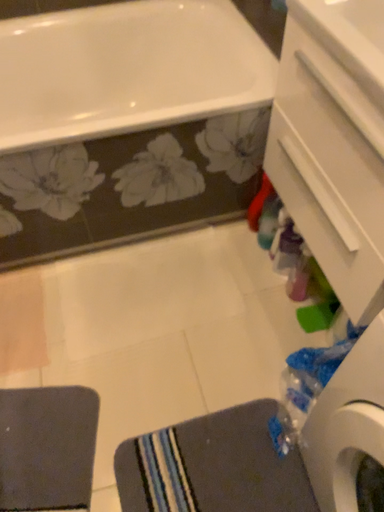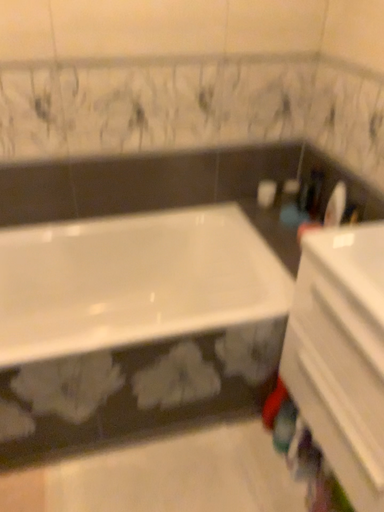
Question: Which way did the camera rotate in the video?

Choices:
 (A) rotated upward
 (B) rotated downward

Answer: (A)